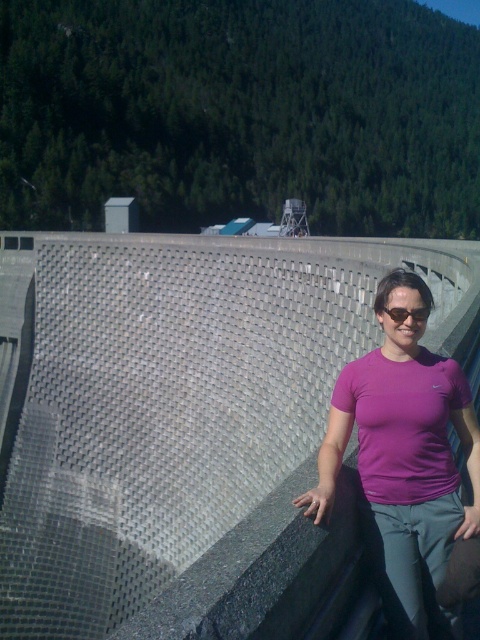
Question: Based on their relative distances, which object is nearer to the black plastic sunglasses at center?

Choices:
 (A) gray textured dam at center
 (B) purple matte t-shirt at center

Answer: (B)

Question: Can you confirm if purple matte t-shirt at center is positioned above black plastic sunglasses at center?

Choices:
 (A) no
 (B) yes

Answer: (A)

Question: Which is farther from the black plastic sunglasses at center?

Choices:
 (A) gray textured dam at center
 (B) purple matte t-shirt at center

Answer: (A)

Question: Can you confirm if gray textured dam at center is bigger than black plastic sunglasses at center?

Choices:
 (A) yes
 (B) no

Answer: (A)

Question: Which object is closer to the camera taking this photo?

Choices:
 (A) gray textured dam at center
 (B) black plastic sunglasses at center

Answer: (A)

Question: Does gray textured dam at center have a greater width compared to purple matte t-shirt at center?

Choices:
 (A) yes
 (B) no

Answer: (A)